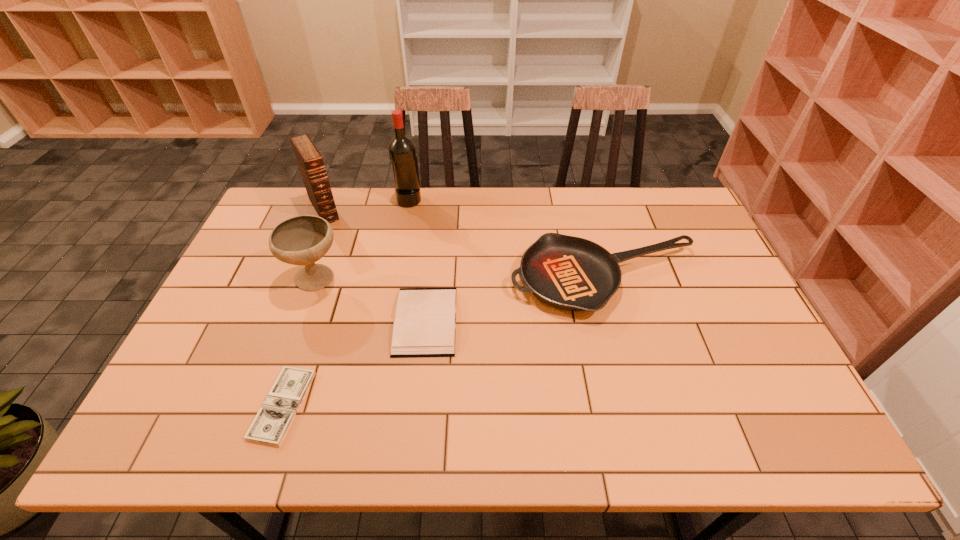
Where is `free space at the far edge`? free space at the far edge is located at coordinates (621, 205).

This screenshot has height=540, width=960. What are the coordinates of `vacant region at the near edge of the desktop` in the screenshot? It's located at (284, 445).

This screenshot has width=960, height=540. What are the coordinates of `free spot at the left edge of the desktop` in the screenshot? It's located at (258, 307).

Where is `blank space at the near left corner of the desktop`? blank space at the near left corner of the desktop is located at coordinates (201, 442).

Where is `free space at the near right corner of the desktop`? The image size is (960, 540). free space at the near right corner of the desktop is located at coordinates (766, 449).

The image size is (960, 540). What are the coordinates of `free space between the nearest object and the fifth tallest object` in the screenshot? It's located at (354, 363).

This screenshot has width=960, height=540. Identify the location of free area in between the fifth shortest object and the rightmost object. (466, 245).

Identify the location of vacant area that lies between the third shortest object and the Bible. (466, 245).

You are a GUI agent. You are given a task and a screenshot of the screen. Output one action in this format:
    pyautogui.click(x=<x>, y=<y>)
    Task: Click on the empty location between the Bible and the frying pan
    This screenshot has width=960, height=540.
    Given the screenshot: What is the action you would take?
    pyautogui.click(x=466, y=245)

Where is `empty space that is in between the nearest object and the fourth shortest object`? empty space that is in between the nearest object and the fourth shortest object is located at coordinates (300, 342).